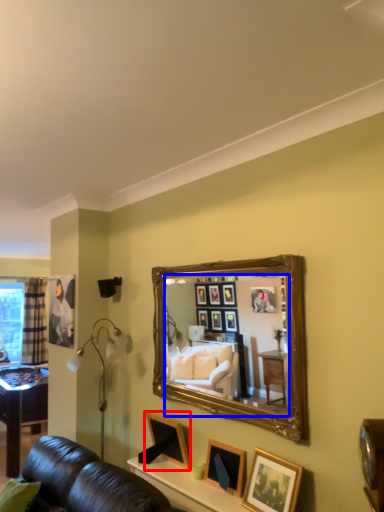
Question: Which object appears closest to the camera in this image, picture frame (highlighted by a red box) or mirror (highlighted by a blue box)?

Choices:
 (A) picture frame
 (B) mirror

Answer: (B)